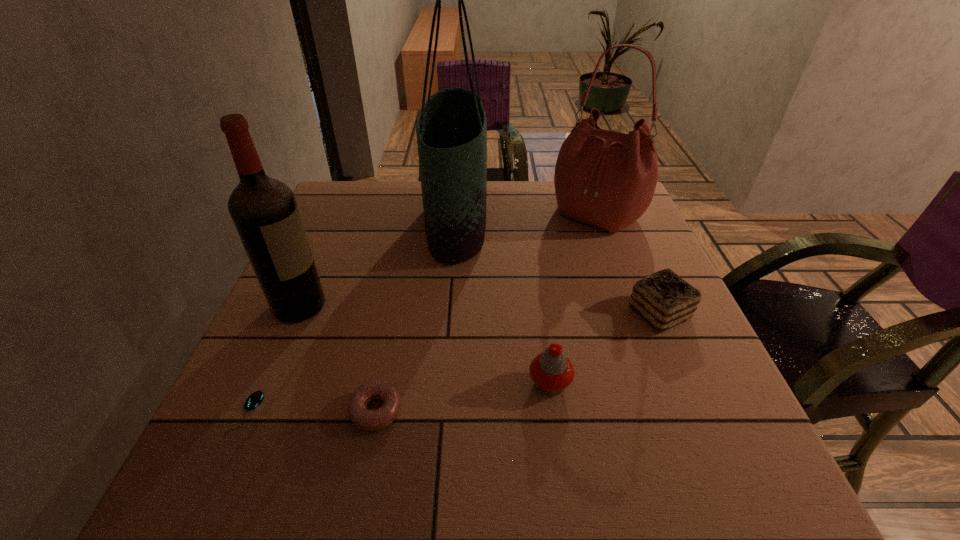
What are the coordinates of `object that is positioned at the far right corner` in the screenshot? It's located at (607, 179).

At what (x,y) coordinates should I click in order to perform the action: click on free region at the far edge. Please return your answer as a coordinate pair (x, y). The image size is (960, 540). Looking at the image, I should click on (512, 200).

Identify the location of free space at the near edge of the desktop. The image size is (960, 540). (580, 480).

In the image, there is a desktop. Where is `vacant space at the left edge`? Image resolution: width=960 pixels, height=540 pixels. vacant space at the left edge is located at coordinates (317, 227).

At what (x,y) coordinates should I click in order to perform the action: click on blank space at the right edge of the desktop. Please return your answer as a coordinate pair (x, y). Looking at the image, I should click on (616, 276).

The image size is (960, 540). Identify the location of free point at the far left corner. (365, 222).

Find the location of a particular element. vacant area that lies between the cupcake and the liquor is located at coordinates (424, 345).

Locate an element on the screen. The image size is (960, 540). empty space that is in between the tote bag and the liquor is located at coordinates (378, 265).

At what (x,y) coordinates should I click in order to perform the action: click on empty space between the tallest object and the shortest object. Please return your answer as a coordinate pair (x, y). Looking at the image, I should click on (351, 319).

Locate an element on the screen. The image size is (960, 540). blank region between the tallest object and the chocolate cake is located at coordinates (558, 268).